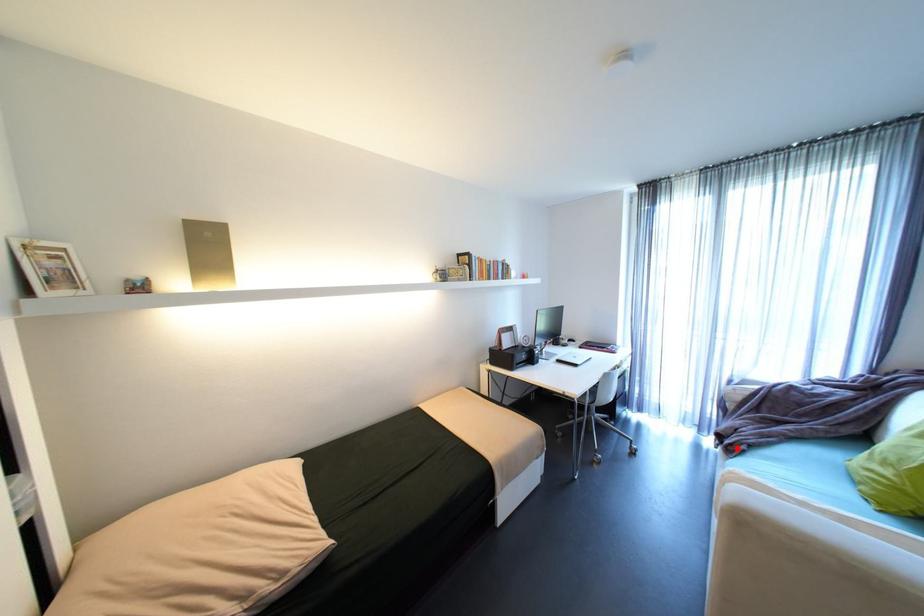
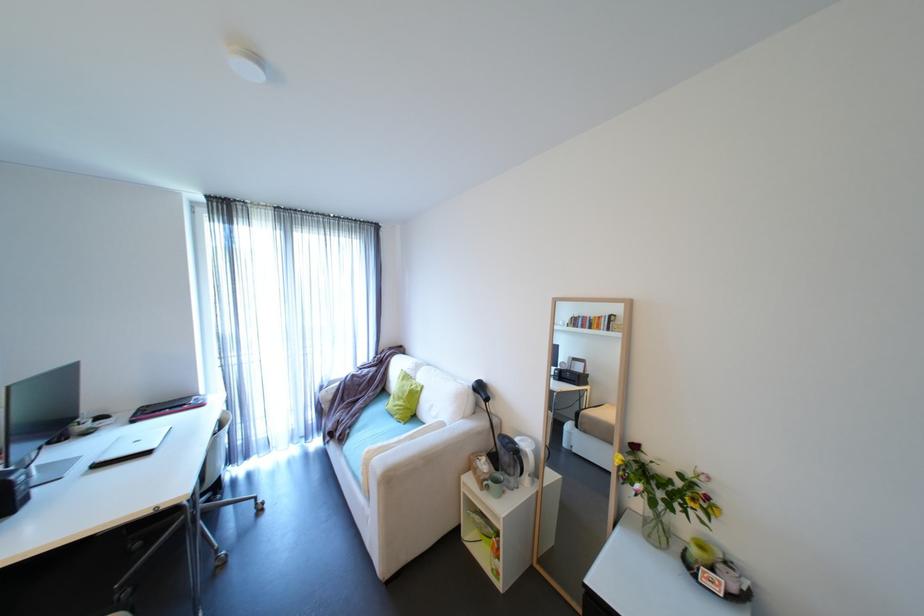
Locate, in the second image, the point that corresponds to the highlighted location in the first image.

(347, 438)